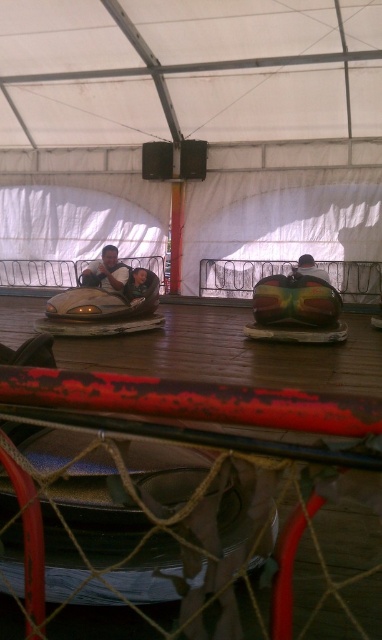
Question: Which point appears closest to the camera in this image?

Choices:
 (A) (129, 280)
 (B) (111, 300)

Answer: (B)

Question: Based on their relative distances, which object is farther from the matte black helmet at center?

Choices:
 (A) smooth plastic helmet at center
 (B) matte silver bumper car at center

Answer: (B)

Question: Does matte black helmet at center appear on the left side of smooth plastic helmet at center?

Choices:
 (A) yes
 (B) no

Answer: (A)

Question: Can you confirm if matte black helmet at center is positioned above smooth plastic helmet at center?

Choices:
 (A) no
 (B) yes

Answer: (B)

Question: Does matte silver bumper car at center appear on the left side of smooth plastic helmet at center?

Choices:
 (A) yes
 (B) no

Answer: (A)

Question: Considering the real-world distances, which object is closest to the smooth plastic helmet at center?

Choices:
 (A) matte silver bumper car at center
 (B) matte black helmet at center

Answer: (B)